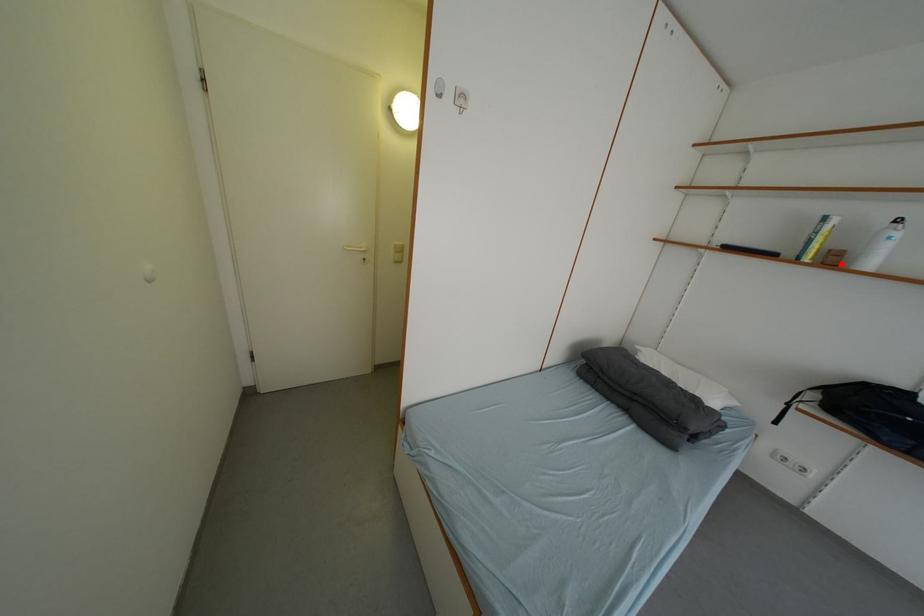
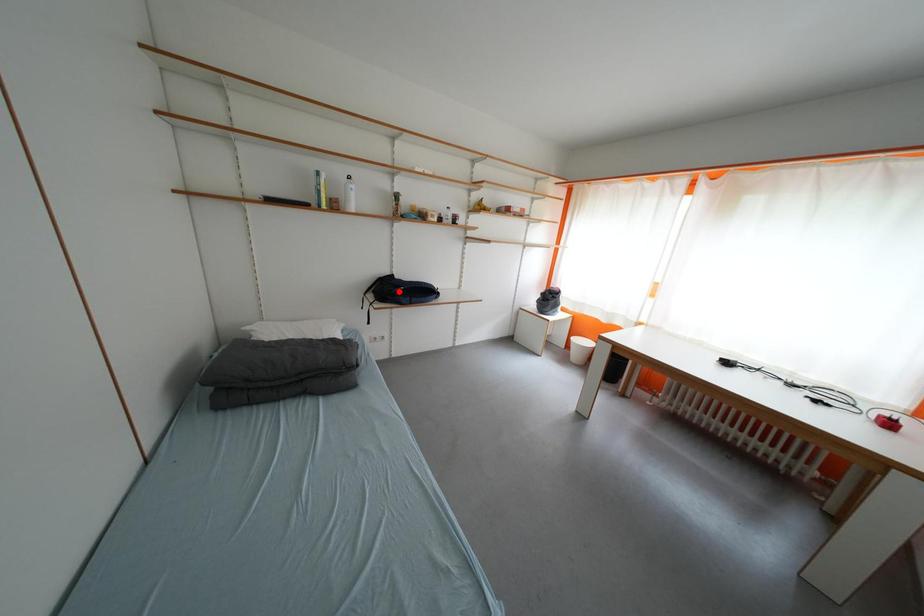
Based on the photo, I am providing you with two images of the same scene from different viewpoints. A red point is marked on the first image and another point is marked on the second image. Is the marked point in image1 the same physical position as the marked point in image2?

No